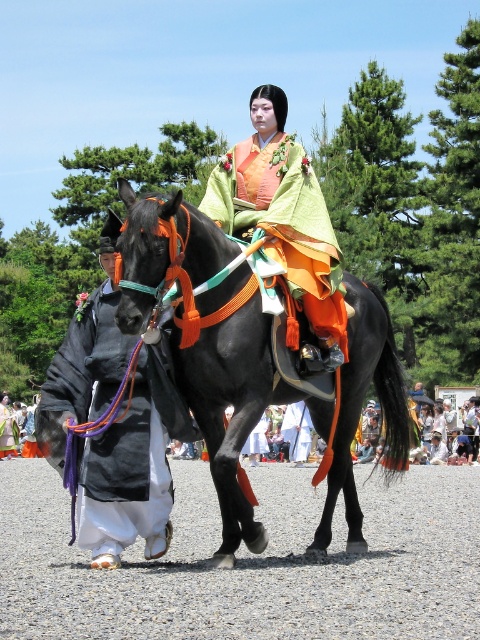
Is point (14, 618) in front of point (164, 518)?

Yes.

Does gray gravel at lower center have a smaller size compared to black silk robe at left?

Correct, gray gravel at lower center occupies less space than black silk robe at left.

Image resolution: width=480 pixels, height=640 pixels. What do you see at coordinates (250, 563) in the screenshot?
I see `gray gravel at lower center` at bounding box center [250, 563].

In order to click on gray gravel at lower center in this screenshot , I will do `click(250, 563)`.

From the picture: Can you confirm if shiny black horse at center is positioned to the right of matte orange kimono at center?

Incorrect, shiny black horse at center is not on the right side of matte orange kimono at center.

Is shiny black horse at center positioned before matte orange kimono at center?

Yes, shiny black horse at center is closer to the viewer.

Is point (262, 337) farther from camera compared to point (333, 324)?

No, it is not.

Identify the location of shiny black horse at center. (252, 362).

Can you confirm if gray gravel at lower center is taller than shiny black horse at center?

Yes.

Who is lower down, gray gravel at lower center or shiny black horse at center?

gray gravel at lower center is lower down.

Between point (147, 577) and point (183, 205), which one is positioned in front?

Point (147, 577)

Identify the location of gray gravel at lower center. (250, 563).